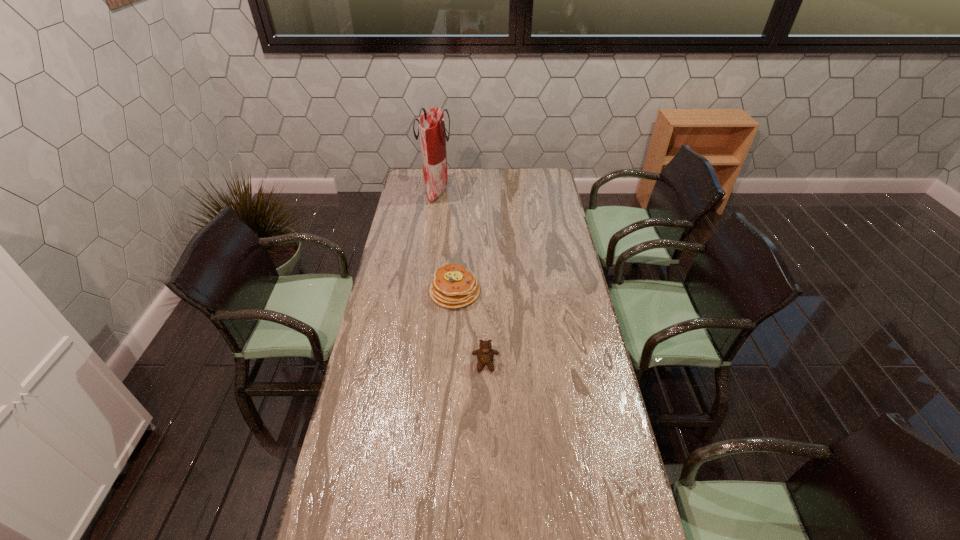
In the image, there is a desktop. At what (x,y) coordinates should I click in order to perform the action: click on vacant region at the far edge. Please return your answer as a coordinate pair (x, y). The height and width of the screenshot is (540, 960). Looking at the image, I should click on (472, 188).

Identify the location of vacant space at the left edge. The width and height of the screenshot is (960, 540). (377, 343).

Locate an element on the screen. This screenshot has height=540, width=960. free location at the right edge of the desktop is located at coordinates (564, 364).

Locate an element on the screen. The image size is (960, 540). free space between the pancake and the teddy bear is located at coordinates (470, 328).

The width and height of the screenshot is (960, 540). Identify the location of free space between the tallest object and the second farthest object. (445, 241).

The width and height of the screenshot is (960, 540). Find the location of `vacant point located between the pancake and the teddy bear`. vacant point located between the pancake and the teddy bear is located at coordinates (470, 328).

You are a GUI agent. You are given a task and a screenshot of the screen. Output one action in this format:
    pyautogui.click(x=<x>, y=<y>)
    Task: Click on the object that is the second nearest to the nearest object
    This screenshot has height=540, width=960.
    Given the screenshot: What is the action you would take?
    pyautogui.click(x=431, y=125)

Where is `object that stands as the closest to the teddy bear`? The height and width of the screenshot is (540, 960). object that stands as the closest to the teddy bear is located at coordinates (453, 286).